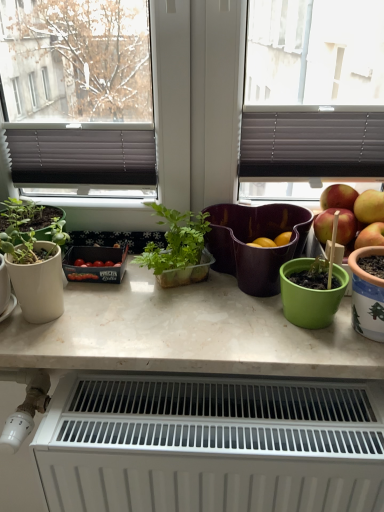
Question: From a real-world perspective, does white marble countertop at center sit lower than white matte radiator at lower center?

Choices:
 (A) no
 (B) yes

Answer: (A)

Question: Does white marble countertop at center contain white matte radiator at lower center?

Choices:
 (A) no
 (B) yes

Answer: (A)

Question: Does white marble countertop at center have a greater width compared to white matte radiator at lower center?

Choices:
 (A) yes
 (B) no

Answer: (A)

Question: From the image's perspective, does white marble countertop at center appear lower than white matte radiator at lower center?

Choices:
 (A) yes
 (B) no

Answer: (B)

Question: From a real-world perspective, is white marble countertop at center on white matte radiator at lower center?

Choices:
 (A) no
 (B) yes

Answer: (B)

Question: Does white marble countertop at center have a greater height compared to white matte radiator at lower center?

Choices:
 (A) no
 (B) yes

Answer: (A)

Question: Is white ceramic pot at right, marked as the 1th flowerpot in a right-to-left arrangement, at the left side of matte purple flowerpot at center, arranged as the first flowerpot when viewed from the back?

Choices:
 (A) no
 (B) yes

Answer: (A)

Question: From a real-world perspective, is white ceramic pot at right, marked as the 1th flowerpot in a right-to-left arrangement, under matte purple flowerpot at center, arranged as the second flowerpot when viewed from the front?

Choices:
 (A) yes
 (B) no

Answer: (B)

Question: Would you say white ceramic pot at right, arranged as the 2th flowerpot when viewed from the left, contains matte purple flowerpot at center, positioned as the first flowerpot in left-to-right order?

Choices:
 (A) no
 (B) yes

Answer: (A)

Question: Is white ceramic pot at right, marked as the 1th flowerpot in a right-to-left arrangement, positioned behind matte purple flowerpot at center, arranged as the second flowerpot when viewed from the front?

Choices:
 (A) no
 (B) yes

Answer: (A)

Question: From the image's perspective, would you say white ceramic pot at right, acting as the 1th flowerpot starting from the front, is positioned over matte purple flowerpot at center, arranged as the first flowerpot when viewed from the back?

Choices:
 (A) no
 (B) yes

Answer: (A)

Question: Are white ceramic pot at right, acting as the 1th flowerpot starting from the front, and matte purple flowerpot at center, arranged as the second flowerpot when viewed from the front, beside each other?

Choices:
 (A) yes
 (B) no

Answer: (B)

Question: From the image's perspective, is matte purple flowerpot at center, the 2th flowerpot in the right-to-left sequence, over white matte radiator at lower center?

Choices:
 (A) yes
 (B) no

Answer: (A)